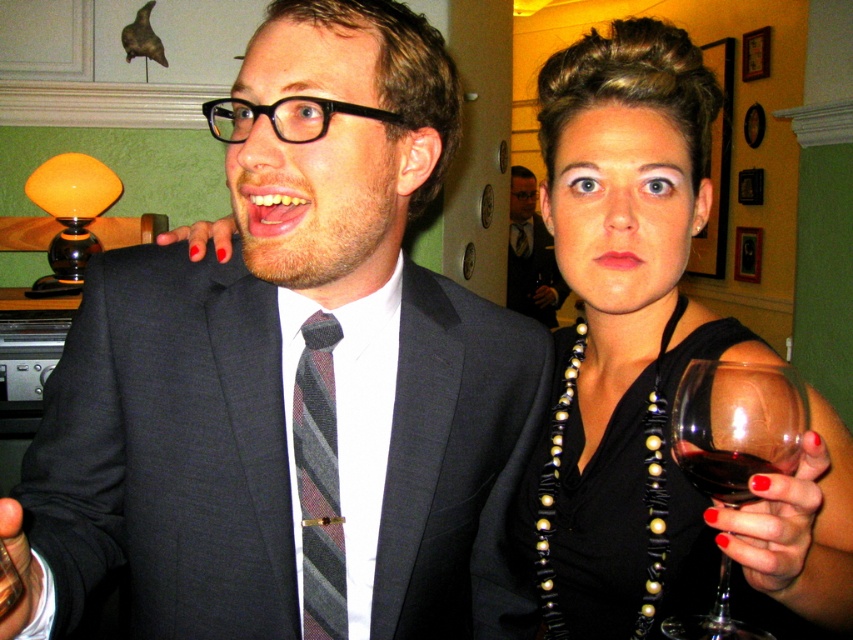
Who is lower down, matte black suit at center or transparent glass at right?

Positioned lower is transparent glass at right.

Which is behind, point (433, 284) or point (675, 426)?

The point (433, 284) is more distant.

Is point (438, 316) positioned behind point (698, 372)?

Yes, it is.

Where is `matte black suit at center`? Image resolution: width=853 pixels, height=640 pixels. matte black suit at center is located at coordinates (293, 376).

This screenshot has width=853, height=640. What do you see at coordinates (735, 426) in the screenshot?
I see `transparent glass at right` at bounding box center [735, 426].

Between transparent glass at right and dark red liquid at right, which one has more height?

transparent glass at right

Between point (791, 417) and point (787, 460), which one is positioned in front?

Point (787, 460) is in front.

Locate an element on the screen. This screenshot has height=640, width=853. transparent glass at right is located at coordinates (735, 426).

Between point (515, 220) and point (732, 493), which one is positioned in front?

Point (732, 493) is more forward.

Does dark gray striped tie at center appear under dark red liquid at right?

No, dark gray striped tie at center is not below dark red liquid at right.

Is point (532, 189) positioned in front of point (674, 452)?

No, (532, 189) is further to viewer.

Identify the location of dark gray striped tie at center. (531, 253).